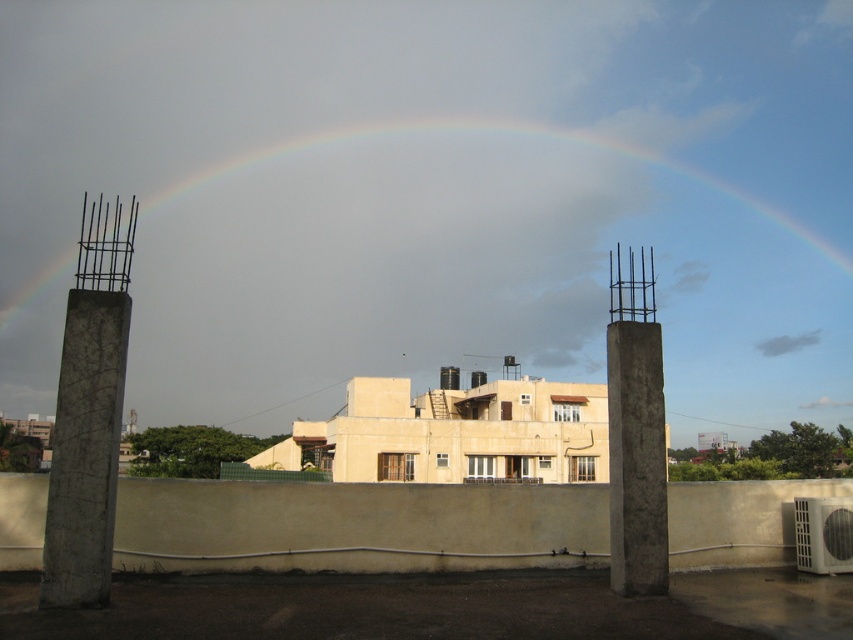
You are standing at the base of the pillars in the foreground of the scene. You want to take a photo of the rainbow at upper center. If your camera can focus on objects up to 200 meters away, will you be able to capture the rainbow clearly?

The rainbow at upper center is 164.08 meters away from the viewer. Since the camera can focus up to 200 meters, it is within range, so yes, you can capture the rainbow clearly.